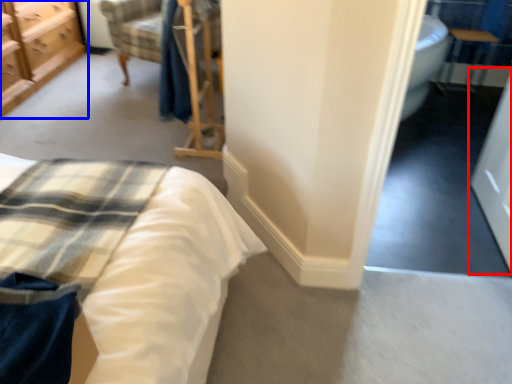
Question: Which of the following is the farthest to the observer, screen door (highlighted by a red box) or chest of drawers (highlighted by a blue box)?

Choices:
 (A) screen door
 (B) chest of drawers

Answer: (B)